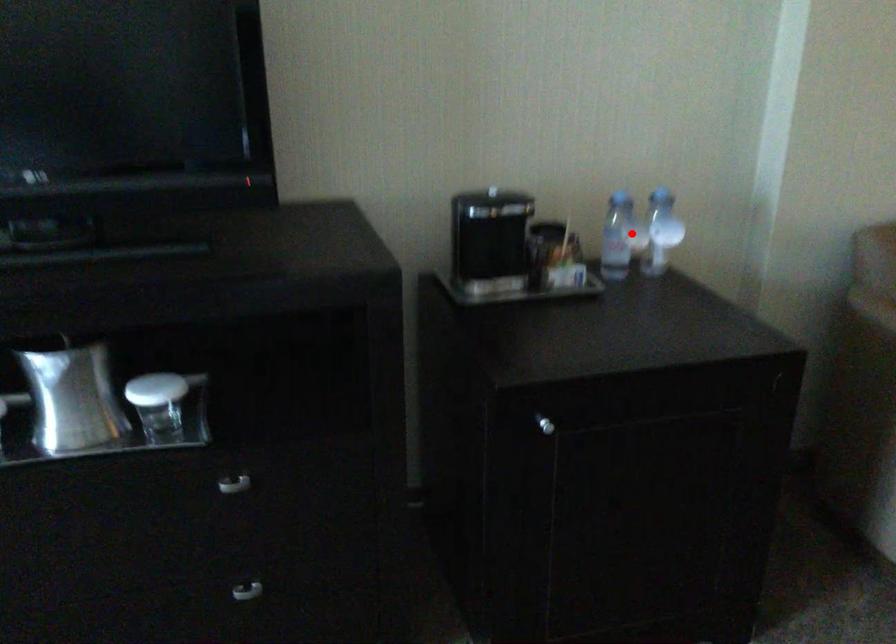
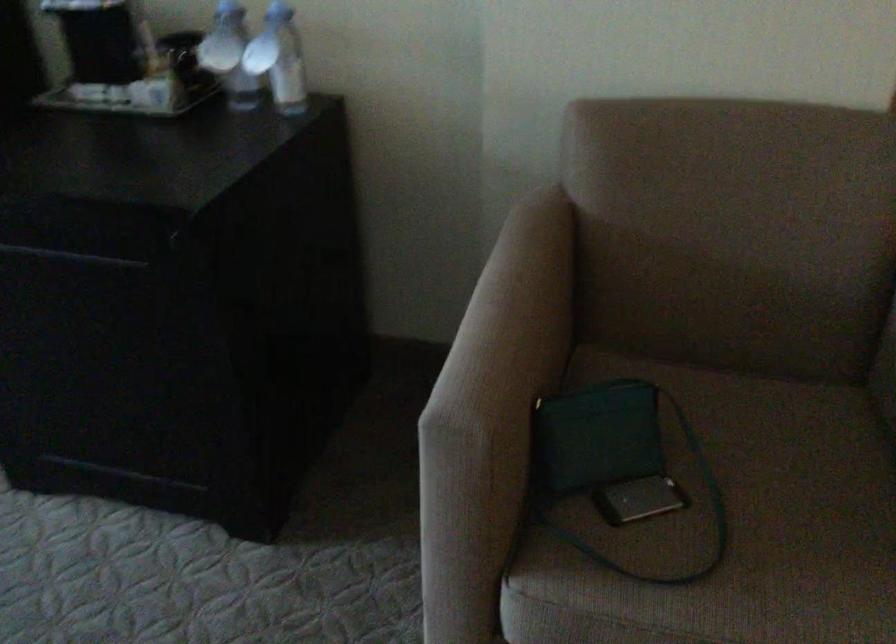
Locate, in the second image, the point that corresponds to the highlighted location in the first image.

(229, 55)